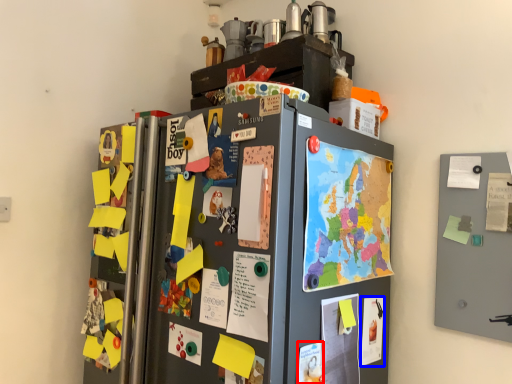
Question: Which object is closer to the camera taking this photo, poster (highlighted by a red box) or poster (highlighted by a blue box)?

Choices:
 (A) poster
 (B) poster

Answer: (A)